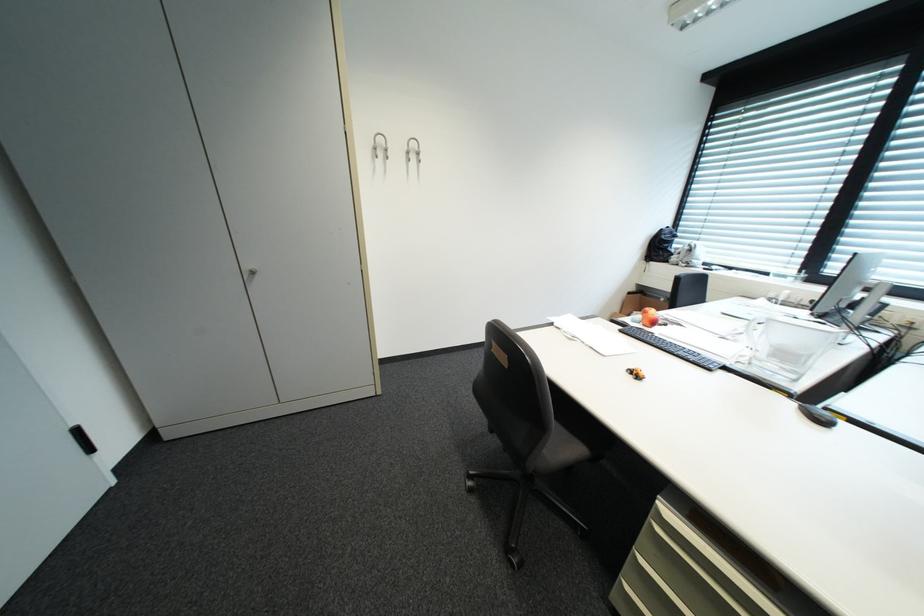
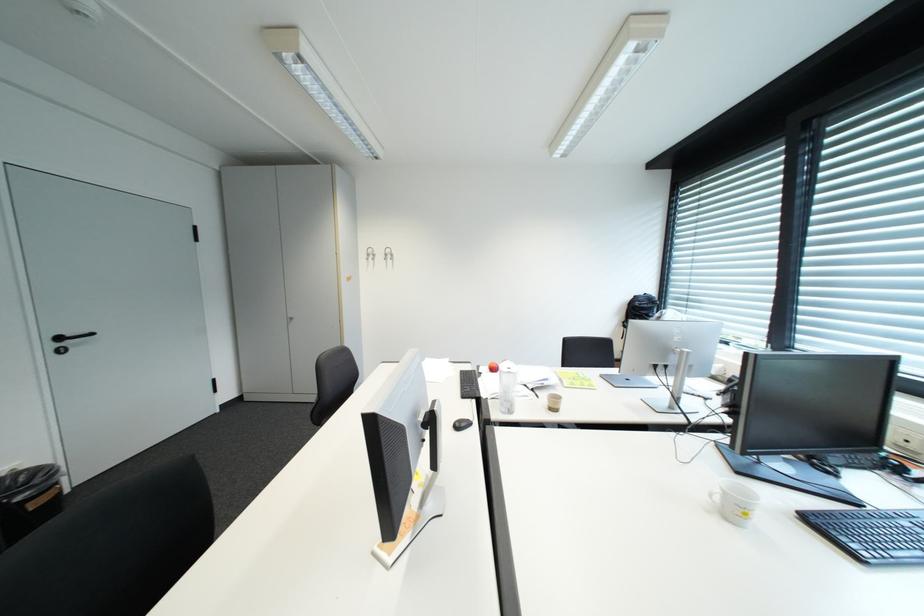
Question: Which direction would the cameraman need to move to produce the second image? Reply with the corresponding letter.

Choices:
 (A) Left
 (B) Right
 (C) Forward
 (D) Backward

Answer: (B)